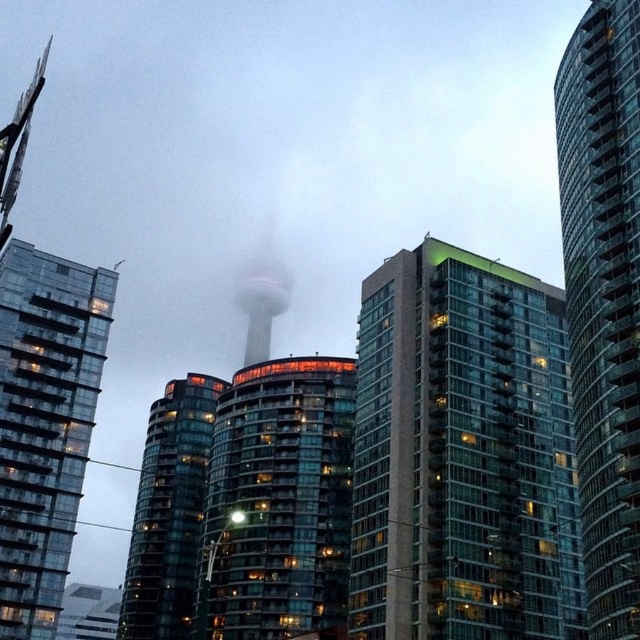
Which is below, transparent glass tower at center or foggy glass cn tower at center?

Positioned lower is transparent glass tower at center.

Can you confirm if transparent glass tower at center is thinner than foggy glass cn tower at center?

Yes.

Between point (634, 512) and point (246, 349), which one is positioned behind?

The point (246, 349) is more distant.

Where is `transparent glass tower at center`? Image resolution: width=640 pixels, height=640 pixels. transparent glass tower at center is located at coordinates (604, 298).

Is transparent glass tower at center wider than transparent glass building at left?

In fact, transparent glass tower at center might be narrower than transparent glass building at left.

Does transparent glass tower at center have a lesser width compared to transparent glass building at left?

Yes, transparent glass tower at center is thinner than transparent glass building at left.

Which is behind, point (612, 244) or point (29, 282)?

Point (29, 282)

The width and height of the screenshot is (640, 640). What are the coordinates of `transparent glass tower at center` in the screenshot? It's located at (604, 298).

Does glassy reflective building at center appear on the left side of foggy glass cn tower at center?

In fact, glassy reflective building at center is to the right of foggy glass cn tower at center.

Who is positioned more to the right, glassy reflective building at center or foggy glass cn tower at center?

From the viewer's perspective, glassy reflective building at center appears more on the right side.

What are the coordinates of `glassy reflective building at center` in the screenshot? It's located at (276, 500).